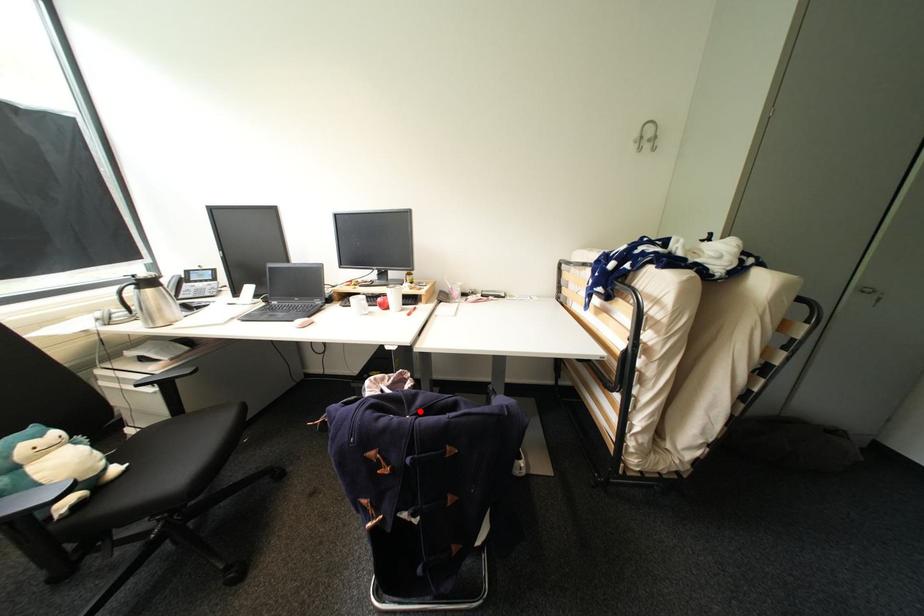
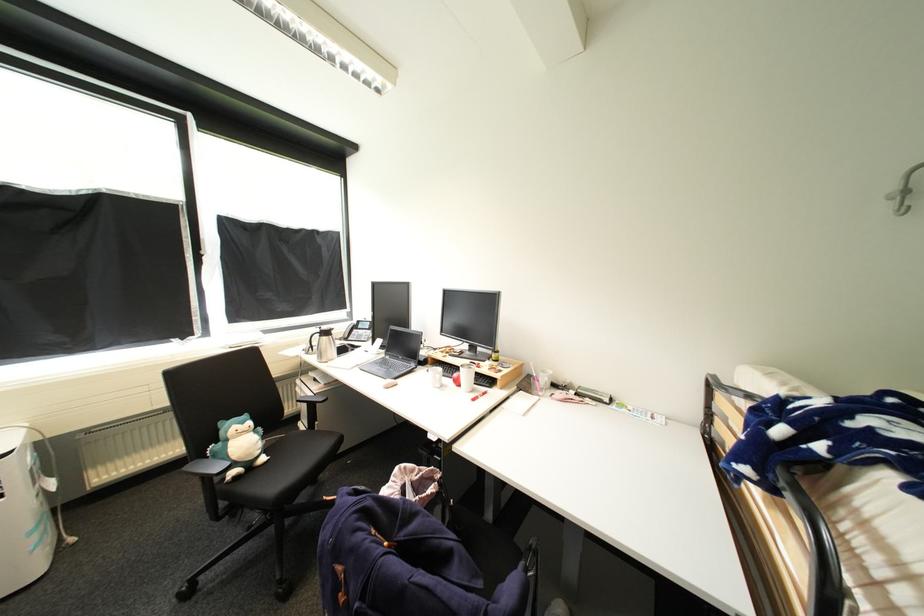
The point at the highlighted location is marked in the first image. Where is the corresponding point in the second image?

(408, 537)